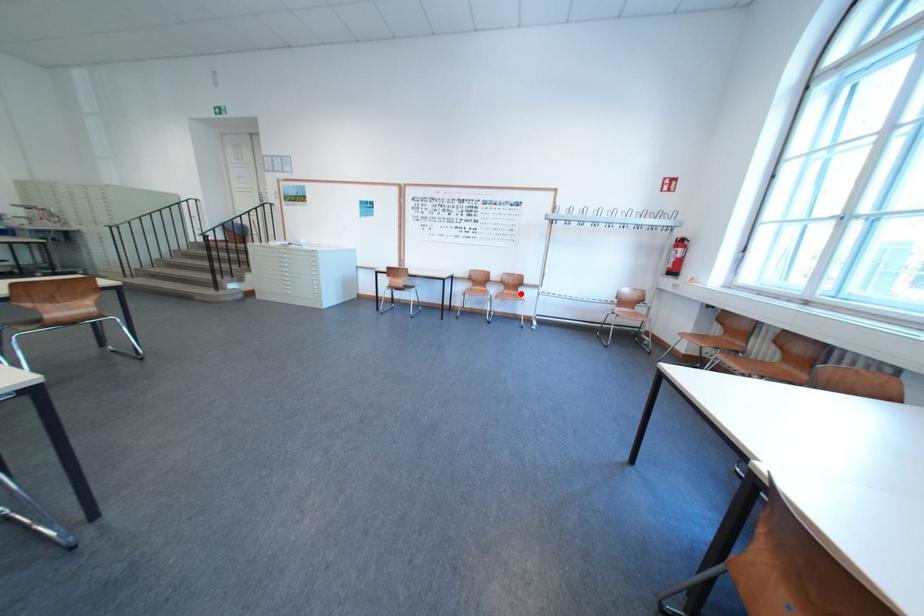
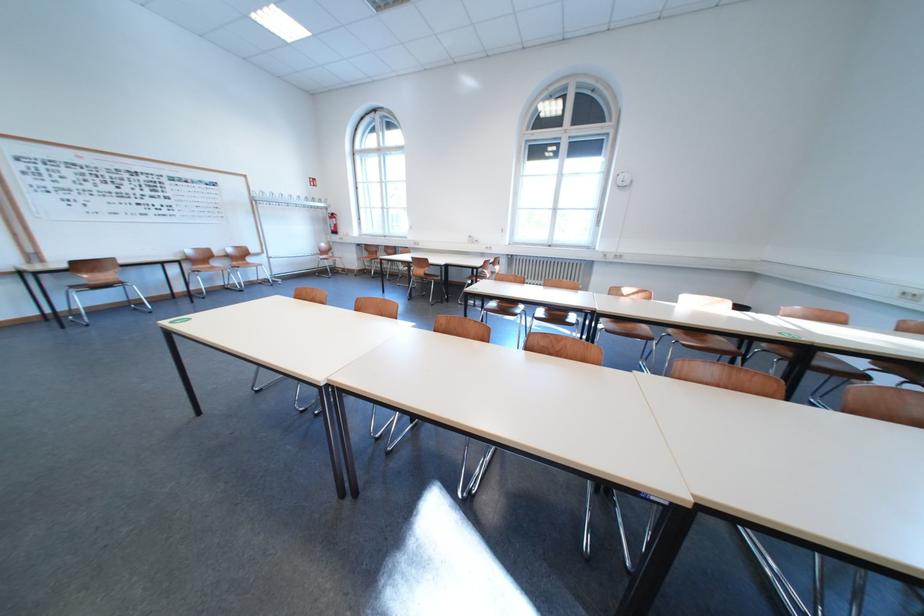
Question: I am providing you with two images of the same scene from different viewpoints. Image1 has a red point marked. In image2, the corresponding 3D location appears at what relative position? Reply with the corresponding letter.

Choices:
 (A) Closer
 (B) Farther

Answer: (A)